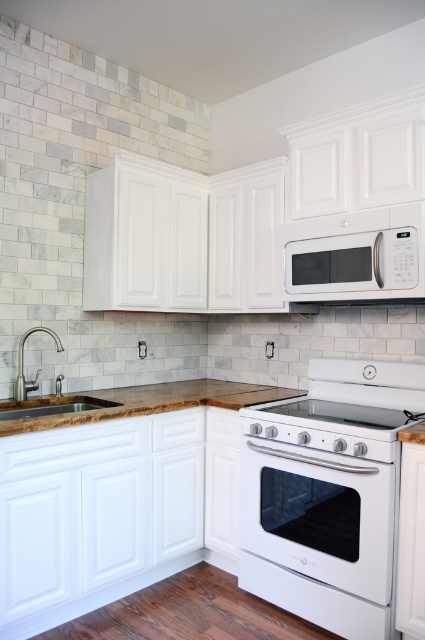
Question: Where is white glossy electric stove at center located in relation to white glossy stove at center in the image?

Choices:
 (A) below
 (B) above

Answer: (A)

Question: Among these points, which one is nearest to the camera?

Choices:
 (A) (337, 276)
 (B) (263, 435)
 (C) (133, 404)

Answer: (B)

Question: Which of these objects is positioned farthest from the brushed nickel faucet at left?

Choices:
 (A) wooden countertop at lower left
 (B) white glossy stove at center
 (C) white matte microwave at upper center
 (D) white glossy electric stove at center

Answer: (C)

Question: Among these objects, which one is nearest to the camera?

Choices:
 (A) white glossy electric stove at center
 (B) wooden countertop at lower left
 (C) white matte microwave at upper center
 (D) white glossy stove at center

Answer: (B)

Question: Can you confirm if white matte microwave at upper center is positioned above wooden countertop at lower left?

Choices:
 (A) yes
 (B) no

Answer: (A)

Question: Observing the image, what is the correct spatial positioning of white glossy stove at center in reference to brushed nickel faucet at left?

Choices:
 (A) above
 (B) below

Answer: (B)